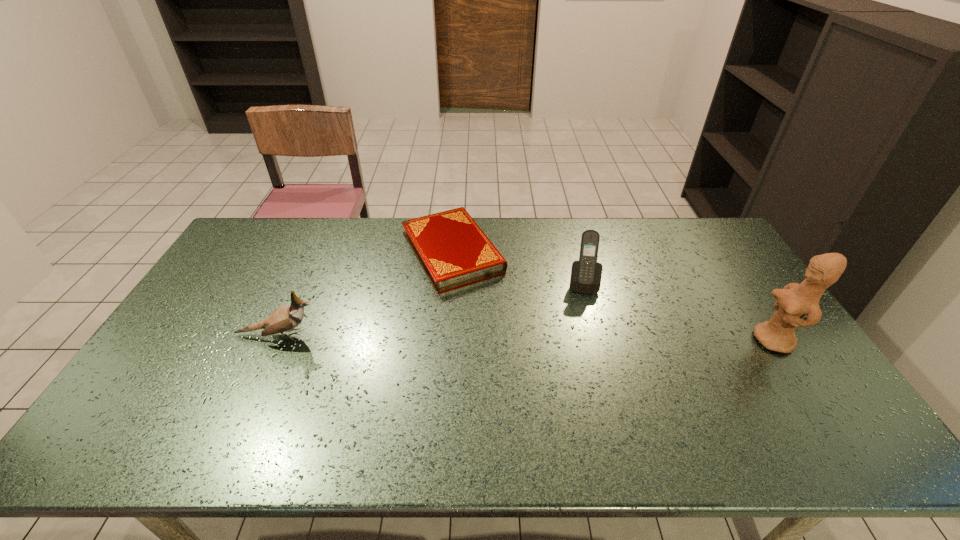
This screenshot has width=960, height=540. I want to click on vacant space on the desktop that is between the leftmost object and the figurine and is positioned on the cover of the shortest object, so click(x=510, y=338).

Locate an element on the screen. This screenshot has height=540, width=960. vacant space on the desktop that is between the leftmost object and the figurine and is positioned on the front-facing side of the second object from right to left is located at coordinates (586, 339).